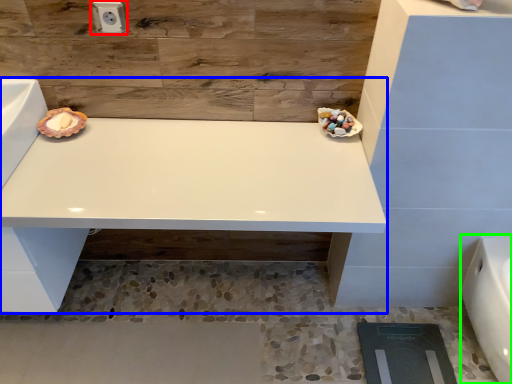
Question: Which is farther away from electric outlet (highlighted by a red box)? vanity (highlighted by a blue box) or porcelain (highlighted by a green box)?

Choices:
 (A) vanity
 (B) porcelain

Answer: (B)